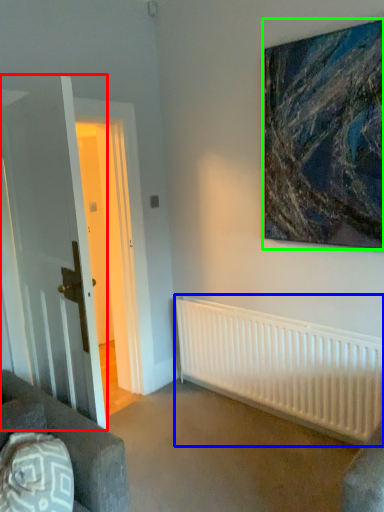
Question: Considering the real-world distances, which object is farthest from glass door (highlighted by a red box)? radiator (highlighted by a blue box) or picture frame (highlighted by a green box)?

Choices:
 (A) radiator
 (B) picture frame

Answer: (B)